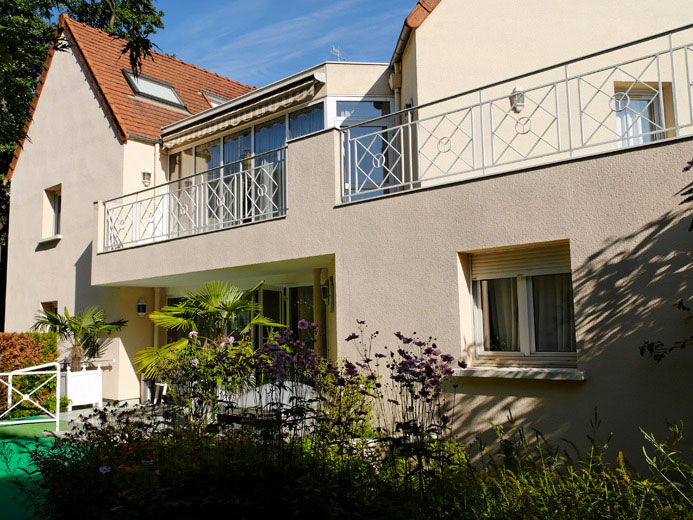
At what (x,y) coordinates should I click in order to perform the action: click on door. Please return your answer as a coordinate pair (x, y). The width and height of the screenshot is (693, 520). Looking at the image, I should click on (267, 305).